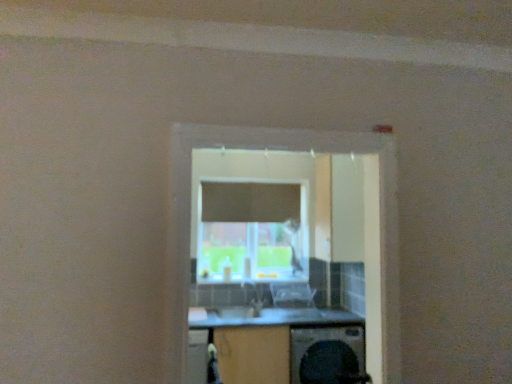
Question: Would you say transparent glass window at center is inside or outside clear plastic chair at center?

Choices:
 (A) outside
 (B) inside

Answer: (A)

Question: Looking at the image, does transparent glass window at center seem bigger or smaller compared to clear plastic chair at center?

Choices:
 (A) small
 (B) big

Answer: (B)

Question: Which is farther from the transparent glass window at center?

Choices:
 (A) wooden at center
 (B) clear plastic chair at center
 (C) black plastic washing machine at lower center

Answer: (B)

Question: Based on their relative distances, which object is farther from the black plastic washing machine at lower center?

Choices:
 (A) wooden at center
 (B) clear plastic chair at center
 (C) transparent glass window at center

Answer: (C)